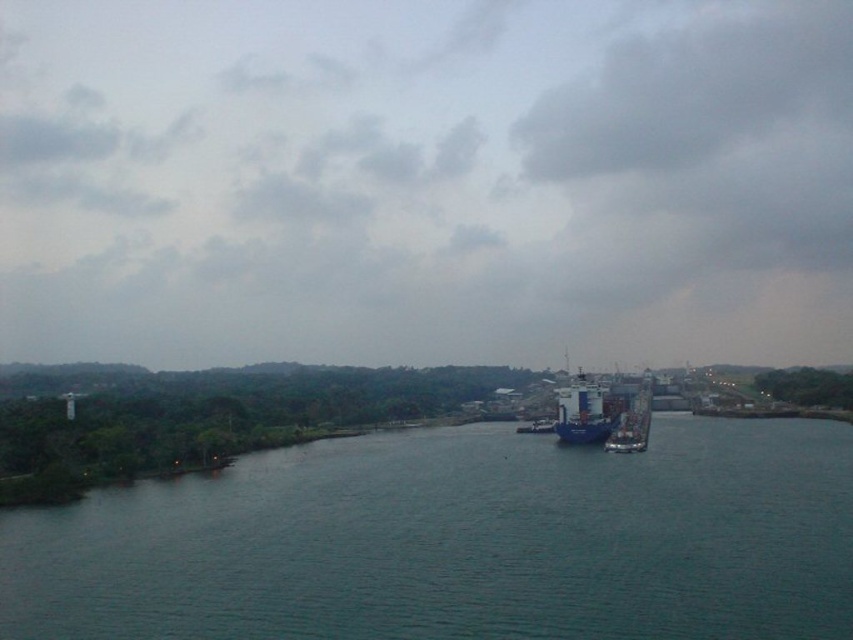
Question: Where is dark blue water at center located in relation to blue matte container ship at center in the image?

Choices:
 (A) above
 (B) below

Answer: (B)

Question: Which point is farther to the camera?

Choices:
 (A) [x=616, y=436]
 (B) [x=751, y=625]
 (C) [x=572, y=419]

Answer: (C)

Question: Which of the following is the farthest from the observer?

Choices:
 (A) dark blue water at center
 (B) blue matte container ship at center

Answer: (B)

Question: Is dark blue water at center to the right of blue metallic cargo ship at center from the viewer's perspective?

Choices:
 (A) no
 (B) yes

Answer: (A)

Question: Does dark blue water at center appear on the right side of blue metallic cargo ship at center?

Choices:
 (A) yes
 (B) no

Answer: (B)

Question: Which object is closer to the camera taking this photo?

Choices:
 (A) blue matte container ship at center
 (B) dark blue water at center
 (C) blue metallic cargo ship at center

Answer: (B)